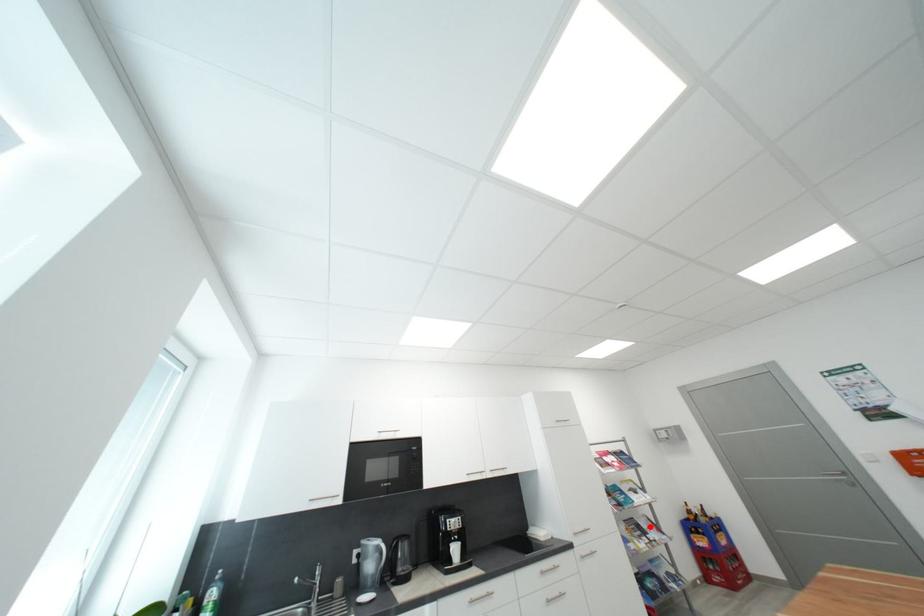
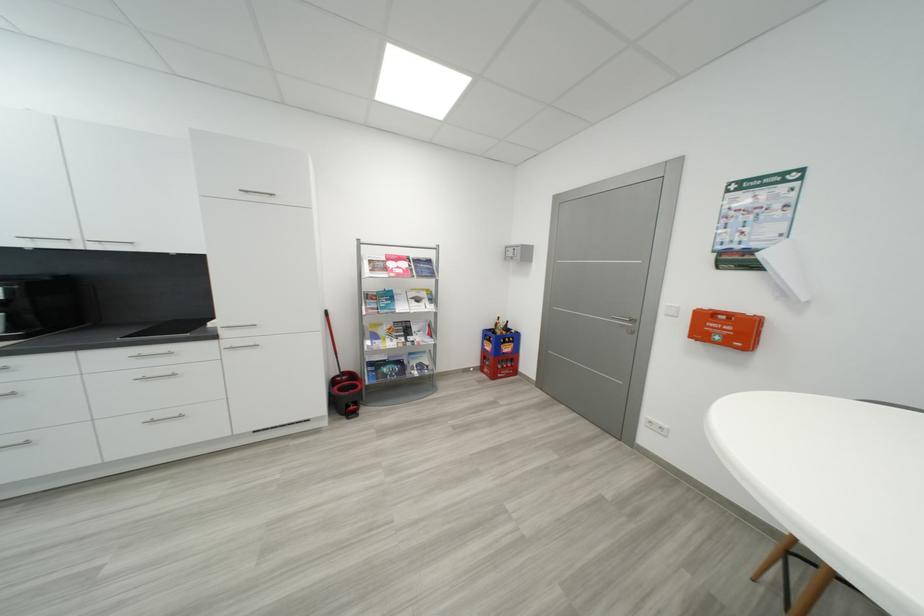
The point at the highlighted location is marked in the first image. Where is the corresponding point in the second image?

(421, 330)